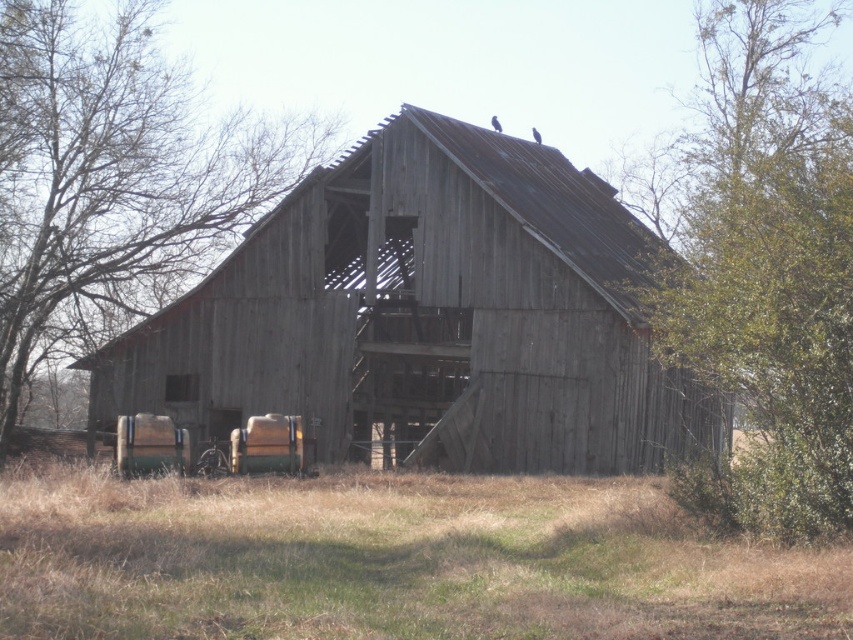
Question: Can you confirm if brown grass at lower center is positioned to the left of brown wood tree at left?

Choices:
 (A) no
 (B) yes

Answer: (A)

Question: Which point appears farthest from the camera in this image?

Choices:
 (A) (122, 140)
 (B) (560, 308)

Answer: (A)

Question: Does brown grass at lower center have a greater width compared to green leafy tree at right?

Choices:
 (A) yes
 (B) no

Answer: (B)

Question: Does brown grass at lower center have a greater width compared to green leafy tree at right?

Choices:
 (A) no
 (B) yes

Answer: (A)

Question: Which object is positioned closest to the brown wood tree at left?

Choices:
 (A) brown grass at lower center
 (B) weathered wood barn at center
 (C) green leafy tree at right

Answer: (B)

Question: Which point is closer to the camera?

Choices:
 (A) weathered wood barn at center
 (B) green leafy tree at right

Answer: (B)